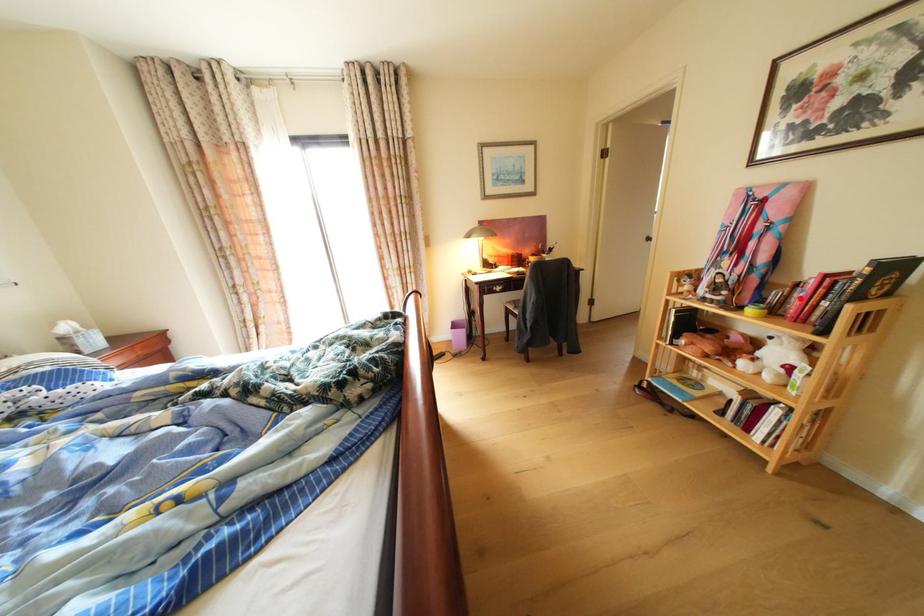
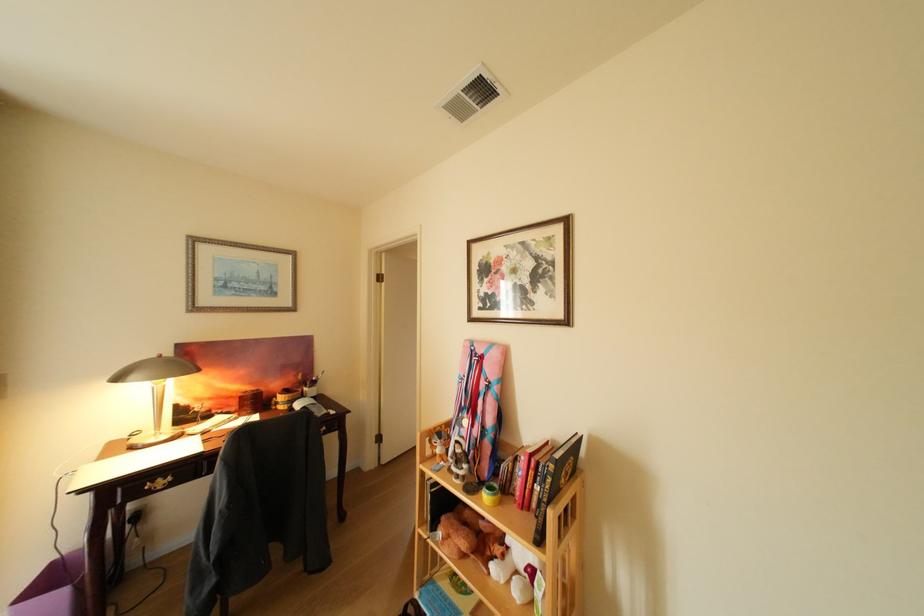
Question: I am providing you with two images of the same scene from different viewpoints. A red point is marked on the first image. Is the red point's position out of view in image 2?

Choices:
 (A) Yes
 (B) No

Answer: (B)